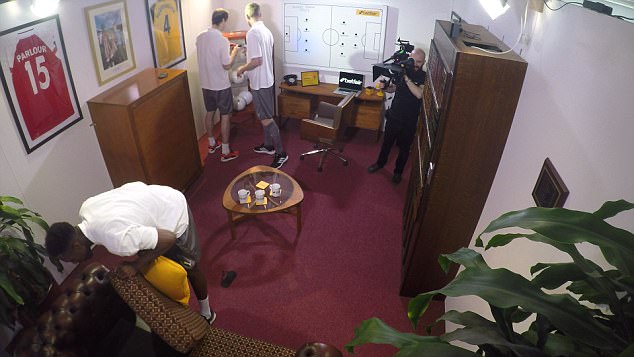
Locate an element on the screen. Image resolution: width=634 pixels, height=357 pixels. lights is located at coordinates (494, 4), (42, 6).